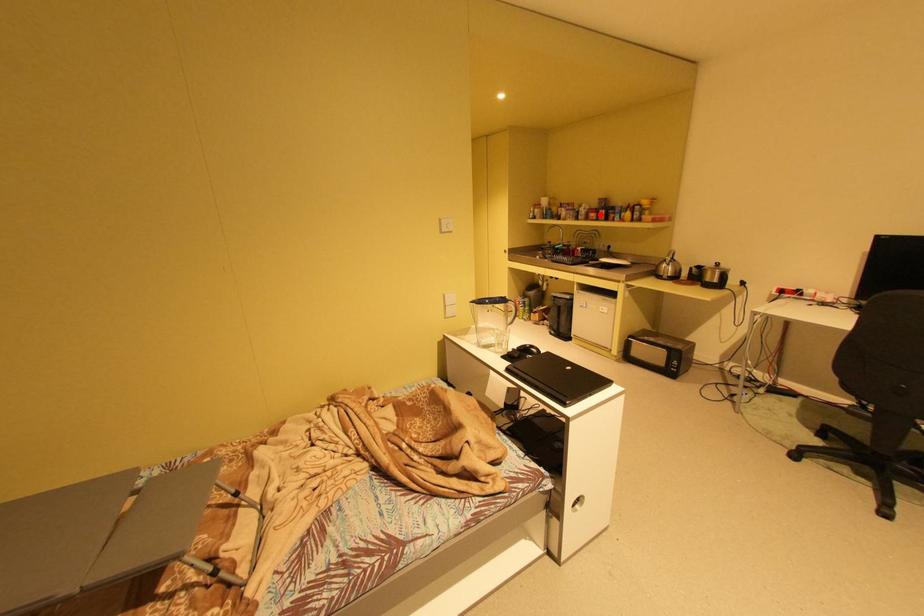
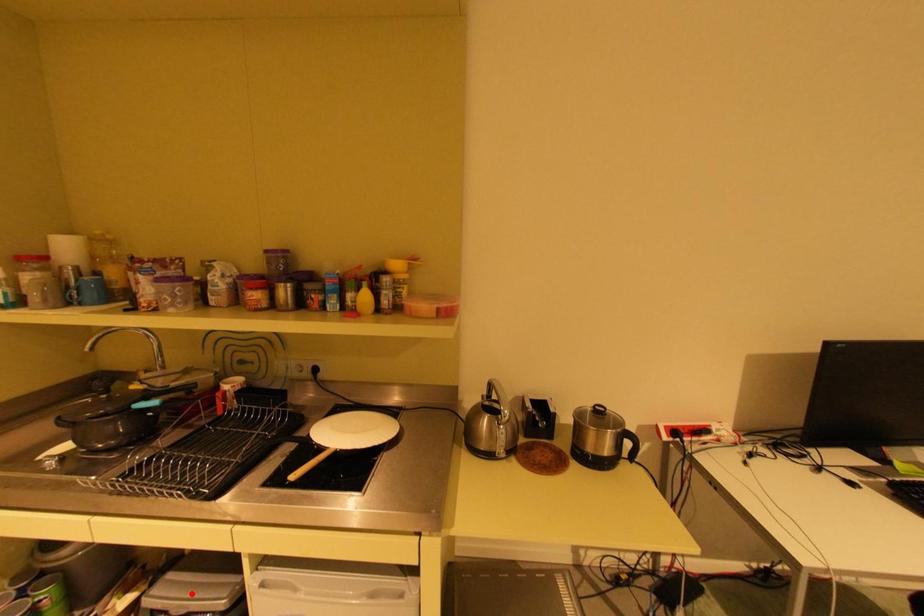
I am providing you with two images of the same scene from different viewpoints. A red point is marked on the first image and another point is marked on the second image. Are the points marked in image1 and image2 representing the same 3D position?

No